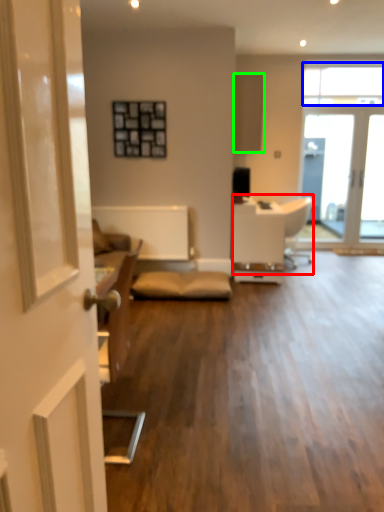
Question: Which object is the closest to the armchair (highlighted by a red box)? Choose among these: window (highlighted by a blue box) or cabinetry (highlighted by a green box).

Choices:
 (A) window
 (B) cabinetry

Answer: (B)